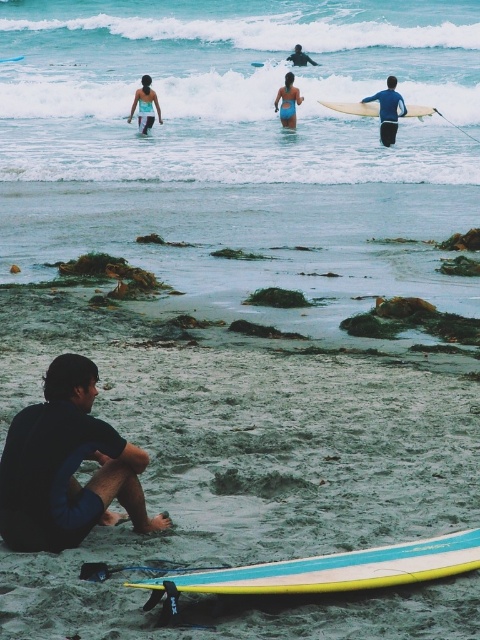
Question: Which point is farther to the camera?

Choices:
 (A) (13, 60)
 (B) (31, 502)
 (C) (297, 563)
 (D) (291, 108)

Answer: (A)

Question: Where is blue matte surfboard at upper center located in relation to blue wetsuit surfboard at upper center in the image?

Choices:
 (A) left
 (B) right

Answer: (B)

Question: Does blue matte surfboard at upper center appear on the left side of yellow foam surfboard at upper right?

Choices:
 (A) no
 (B) yes

Answer: (A)

Question: Does clear blue water at upper center have a greater width compared to dark blue wetsuit at lower left?

Choices:
 (A) yes
 (B) no

Answer: (A)

Question: Which of the following is the farthest from the observer?

Choices:
 (A) (228, 157)
 (B) (140, 106)
 (C) (369, 582)
 (D) (383, 108)

Answer: (B)

Question: Which point is farther to the camera?

Choices:
 (A) blue glossy surfboard at lower center
 (B) matte blue swimsuit at upper center

Answer: (A)